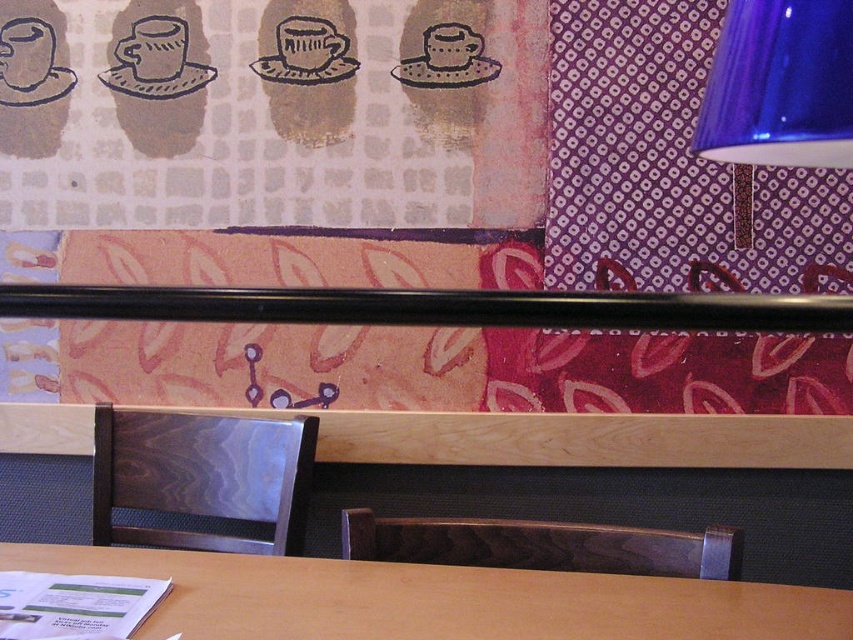
You are taking a photo of the scene and want to focus on both the point at (132,449) and the point at (793,163). Which point should you focus on first to ensure both are in focus?

You should focus on the point at (132,449) first because it is closer to the camera than the point at (793,163). By focusing on the closer point, the farther point will also be within the depth of field.

You are standing at the entrance of the cafe and want to walk towards the table. Which point, point (494, 609) or point (596, 534), is closer to you as you face the table?

Point (494, 609) is closer to you because it is in front of point (596, 534).

You are standing at the entrance of the cafe and want to sit down. There is a wooden chair at lower center. Can you walk directly to it without moving around any obstacles?

Yes, you can walk directly to the wooden chair at lower center because its position at point (201, 476) indicates it is centrally located and unobstructed in the frame.